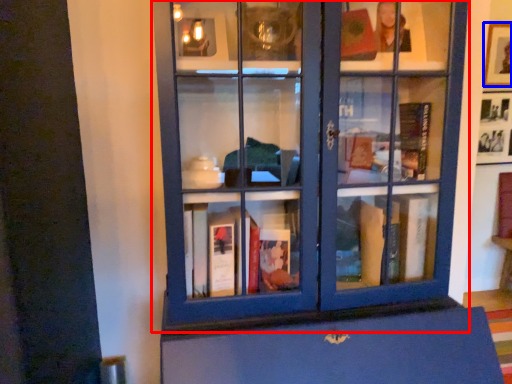
Question: Which object appears closest to the camera in this image, bookcase (highlighted by a red box) or picture frame (highlighted by a blue box)?

Choices:
 (A) bookcase
 (B) picture frame

Answer: (A)